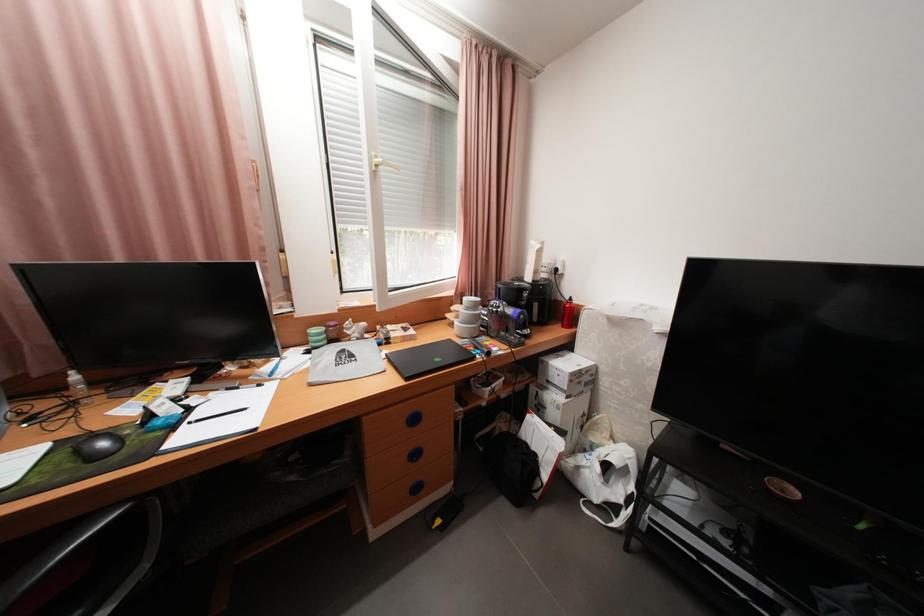
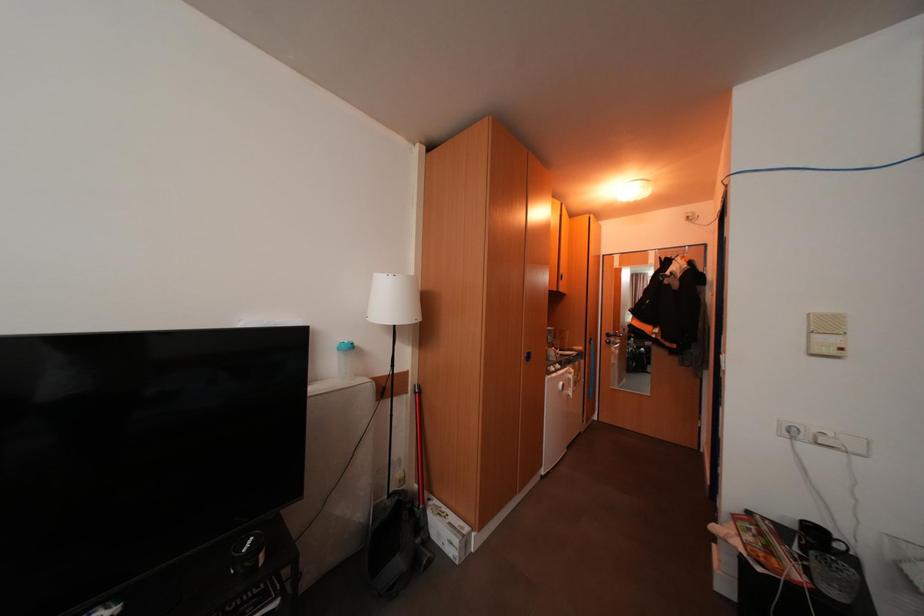
Question: Based on the continuous images, in which direction is the camera rotating? Reply with the corresponding letter.

Choices:
 (A) Left
 (B) Right
 (C) Up
 (D) Down

Answer: (B)